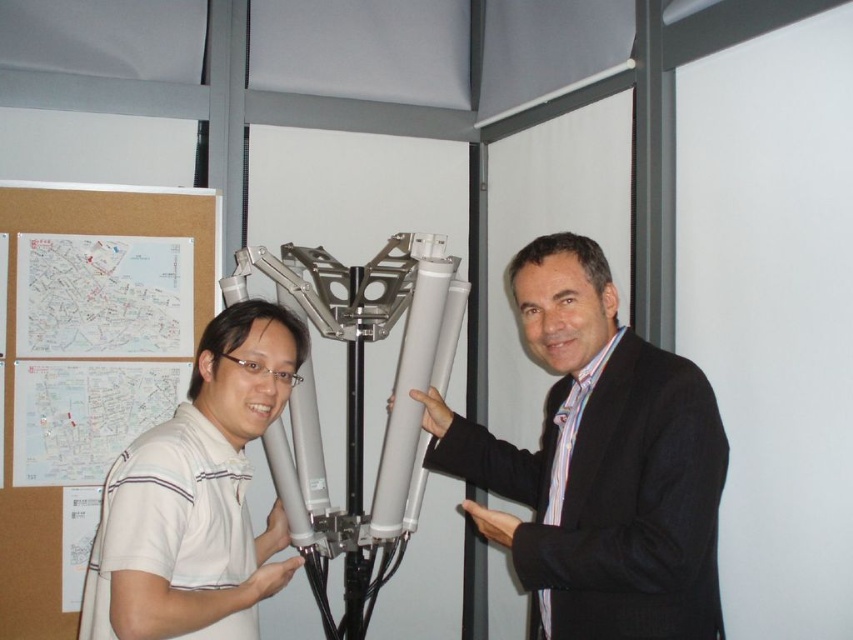
Between matte white cylinder at center and white striped polo shirt at center, which one appears on the left side from the viewer's perspective?

white striped polo shirt at center is more to the left.

Who is higher up, matte white cylinder at center or white striped polo shirt at center?

matte white cylinder at center is higher up.

Describe the element at coordinates (598, 464) in the screenshot. The height and width of the screenshot is (640, 853). I see `matte white cylinder at center` at that location.

This screenshot has height=640, width=853. Find the location of `matte white cylinder at center`. matte white cylinder at center is located at coordinates (598, 464).